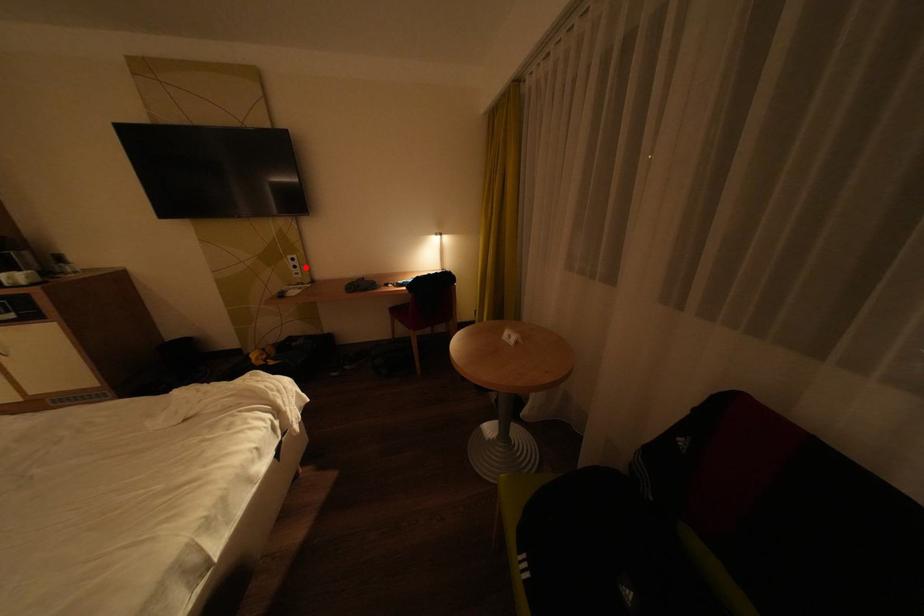
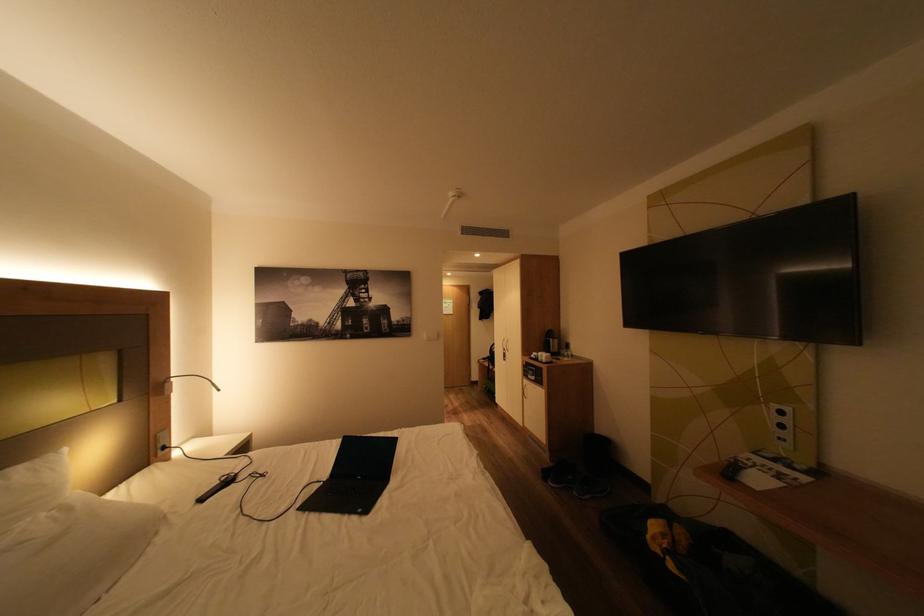
Where in the second image is the point corresponding to the highlighted location from the first image?

(793, 427)